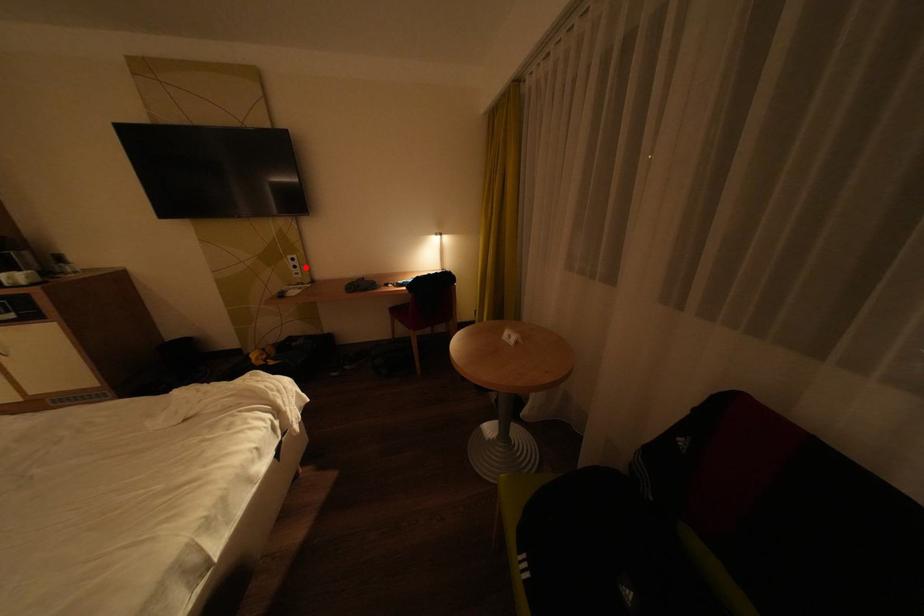
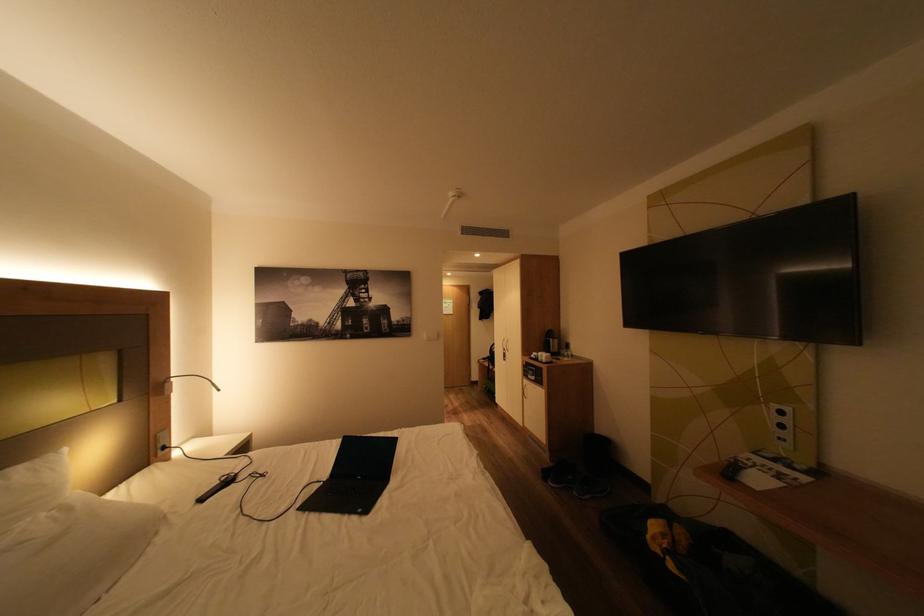
Where in the second image is the point corresponding to the highlighted location from the first image?

(793, 427)